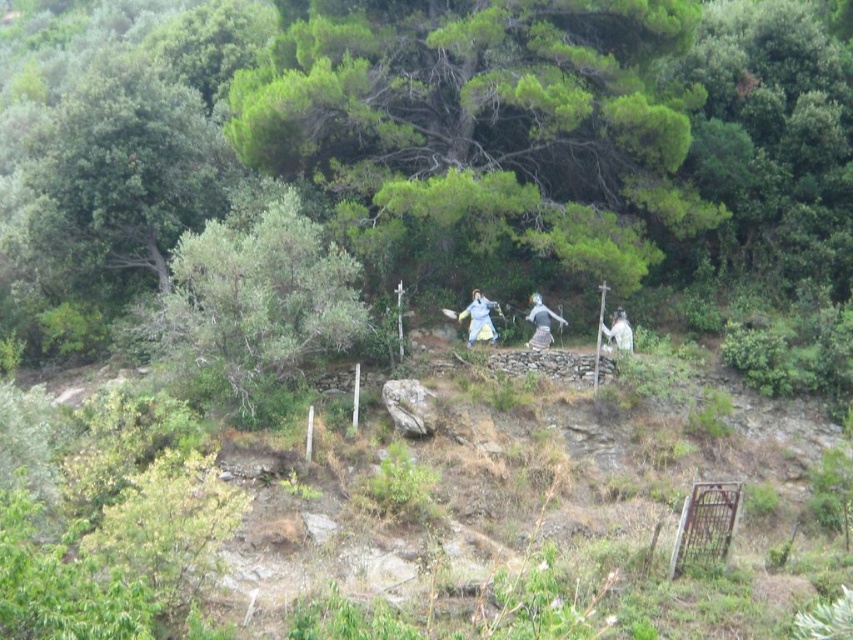
You are standing at the base of the hillside and see the point marked at coordinates (253, 305). Which object is this point located on?

The point marked at coordinates (253, 305) is located on the green leafy tree at center.

In the scene shown: You are an art curator planning to display the matte white statue at center and the metallic silver statue at center in a gallery. Given their heights, which statue should be placed on a higher pedestal to ensure both appear balanced in size from the visitor perspective?

The matte white statue at center should be placed on a higher pedestal because it has a lesser height compared to the metallic silver statue at center, helping to balance their visual sizes.